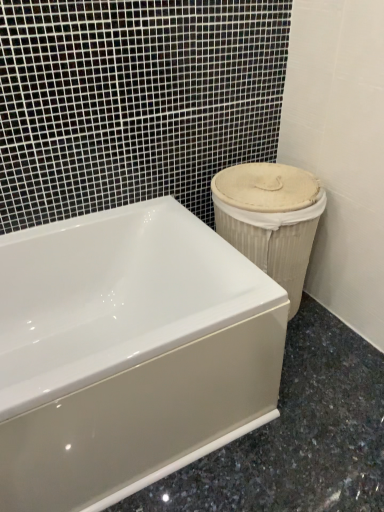
This screenshot has width=384, height=512. What are the coordinates of `white glossy bathtub at center` in the screenshot? It's located at (128, 353).

This screenshot has width=384, height=512. What do you see at coordinates (128, 353) in the screenshot?
I see `white glossy bathtub at center` at bounding box center [128, 353].

Identify the location of beige woven basket at right. (270, 219).

In order to face beige woven basket at right, should I rotate leftwards or rightwards?

Rotate right and turn 8.715 degrees.

Image resolution: width=384 pixels, height=512 pixels. What do you see at coordinates (270, 219) in the screenshot?
I see `beige woven basket at right` at bounding box center [270, 219].

Locate an element on the screen. This screenshot has height=512, width=384. white glossy bathtub at center is located at coordinates (128, 353).

Based on their positions, is white glossy bathtub at center located to the left or right of beige woven basket at right?

Clearly, white glossy bathtub at center is on the left of beige woven basket at right in the image.

Looking at this image, considering the positions of objects white glossy bathtub at center and beige woven basket at right in the image provided, who is behind, white glossy bathtub at center or beige woven basket at right?

beige woven basket at right is further from the camera.

Does point (270, 341) lie behind point (322, 207)?

No, (270, 341) is in front of (322, 207).

From the image's perspective, who appears lower, white glossy bathtub at center or beige woven basket at right?

From the image's view, white glossy bathtub at center is below.

From a real-world perspective, is white glossy bathtub at center physically located above or below beige woven basket at right?

Clearly, from a real-world perspective, white glossy bathtub at center is below beige woven basket at right.

Which object is wider, white glossy bathtub at center or beige woven basket at right?

Wider between the two is white glossy bathtub at center.

Does white glossy bathtub at center have a lesser height compared to beige woven basket at right?

Yes, white glossy bathtub at center is shorter than beige woven basket at right.

Who is smaller, white glossy bathtub at center or beige woven basket at right?

beige woven basket at right is smaller.

Is white glossy bathtub at center situated inside beige woven basket at right or outside?

white glossy bathtub at center is outside beige woven basket at right.

Looking at this image, is white glossy bathtub at center positioned far away from beige woven basket at right?

white glossy bathtub at center is near beige woven basket at right, not far away.

From the picture: Does white glossy bathtub at center turn towards beige woven basket at right?

No, white glossy bathtub at center is not facing towards beige woven basket at right.

How many degrees apart are the facing directions of white glossy bathtub at center and beige woven basket at right?

white glossy bathtub at center and beige woven basket at right are facing 0.838 degrees away from each other.

This screenshot has height=512, width=384. Identify the location of bathtub to the left of beige woven basket at right. (128, 353).

Does beige woven basket at right appear on the right side of white glossy bathtub at center?

Correct, you'll find beige woven basket at right to the right of white glossy bathtub at center.

Which object is closer to the camera taking this photo, beige woven basket at right or white glossy bathtub at center?

white glossy bathtub at center is more forward.

Is point (214, 209) farther from camera compared to point (254, 288)?

Yes, point (214, 209) is behind point (254, 288).

From the image's perspective, who appears lower, beige woven basket at right or white glossy bathtub at center?

white glossy bathtub at center, from the image's perspective.

From a real-world perspective, is beige woven basket at right above or below white glossy bathtub at center?

beige woven basket at right is above white glossy bathtub at center.

Between beige woven basket at right and white glossy bathtub at center, which one has smaller width?

beige woven basket at right is thinner.

From their relative heights in the image, would you say beige woven basket at right is taller or shorter than white glossy bathtub at center?

Clearly, beige woven basket at right is taller compared to white glossy bathtub at center.

Is beige woven basket at right smaller than white glossy bathtub at center?

Yes, beige woven basket at right is smaller than white glossy bathtub at center.

Is beige woven basket at right positioned beyond the bounds of white glossy bathtub at center?

beige woven basket at right lies outside white glossy bathtub at center's area.

Is beige woven basket at right next to white glossy bathtub at center and touching it?

No, beige woven basket at right is not touching white glossy bathtub at center.

Is beige woven basket at right looking in the opposite direction of white glossy bathtub at center?

That's not correct — beige woven basket at right is not looking away from white glossy bathtub at center.

This screenshot has height=512, width=384. I want to click on bathtub located on the left of beige woven basket at right, so point(128,353).

I want to click on bathtub in front of the beige woven basket at right, so click(128, 353).

Locate an element on the screen. This screenshot has height=512, width=384. bathtub beneath the beige woven basket at right (from a real-world perspective) is located at coordinates (128, 353).